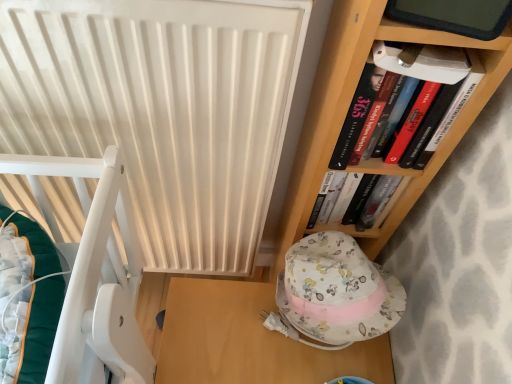
Question: From a real-world perspective, relative to white matte radiator at center, is wooden table at lower center vertically above or below?

Choices:
 (A) below
 (B) above

Answer: (A)

Question: Relative to white matte radiator at center, is wooden table at lower center in front or behind?

Choices:
 (A) behind
 (B) front

Answer: (A)

Question: Considering the real-world distances, which object is farthest from the white matte radiator at center?

Choices:
 (A) hardcover book at upper right
 (B) wooden table at lower center
 (C) floral fabric hat at lower center

Answer: (B)

Question: Considering the real-world distances, which object is closest to the wooden table at lower center?

Choices:
 (A) floral fabric hat at lower center
 (B) hardcover book at upper right
 (C) white matte radiator at center

Answer: (A)